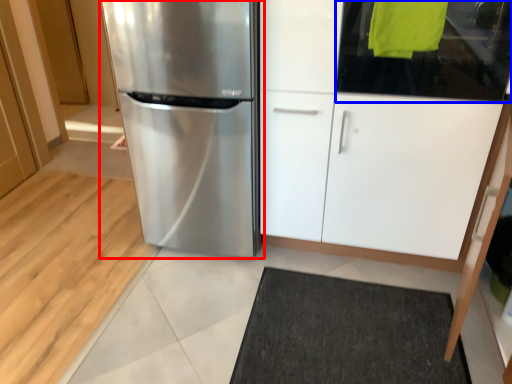
Question: Which object appears closest to the camera in this image, refrigerator (highlighted by a red box) or glass door (highlighted by a blue box)?

Choices:
 (A) refrigerator
 (B) glass door

Answer: (B)